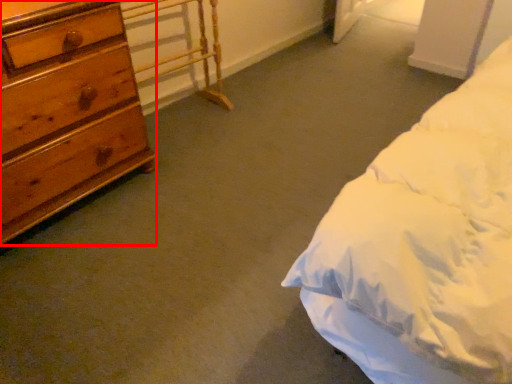
Question: Observing the image, what is the correct spatial positioning of chest of drawers (annotated by the red box) in reference to table?

Choices:
 (A) left
 (B) right

Answer: (A)